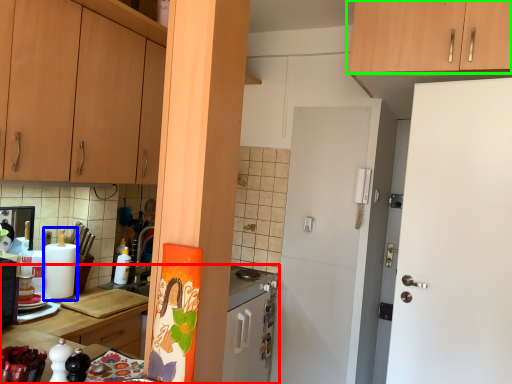
Question: Which object is the farthest from countertop (highlighted by a red box)? Choose among these: appliance (highlighted by a blue box) or cabinetry (highlighted by a green box).

Choices:
 (A) appliance
 (B) cabinetry

Answer: (B)